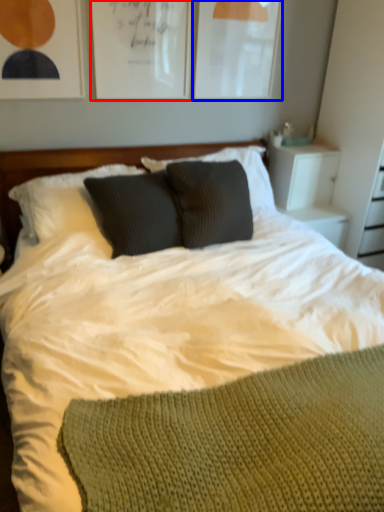
Question: Which of the following is the farthest to the observer, picture frame (highlighted by a red box) or picture frame (highlighted by a blue box)?

Choices:
 (A) picture frame
 (B) picture frame

Answer: (B)